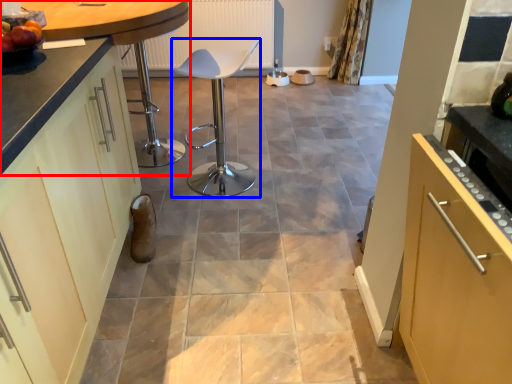
Question: Among these objects, which one is nearest to the camera, countertop (highlighted by a red box) or chair (highlighted by a blue box)?

Choices:
 (A) countertop
 (B) chair

Answer: (A)